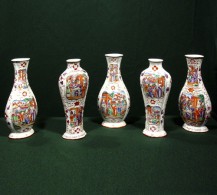
Find the location of a particular element. This screenshot has height=195, width=217. space between vases is located at coordinates (47, 111), (89, 111), (136, 109), (171, 111).